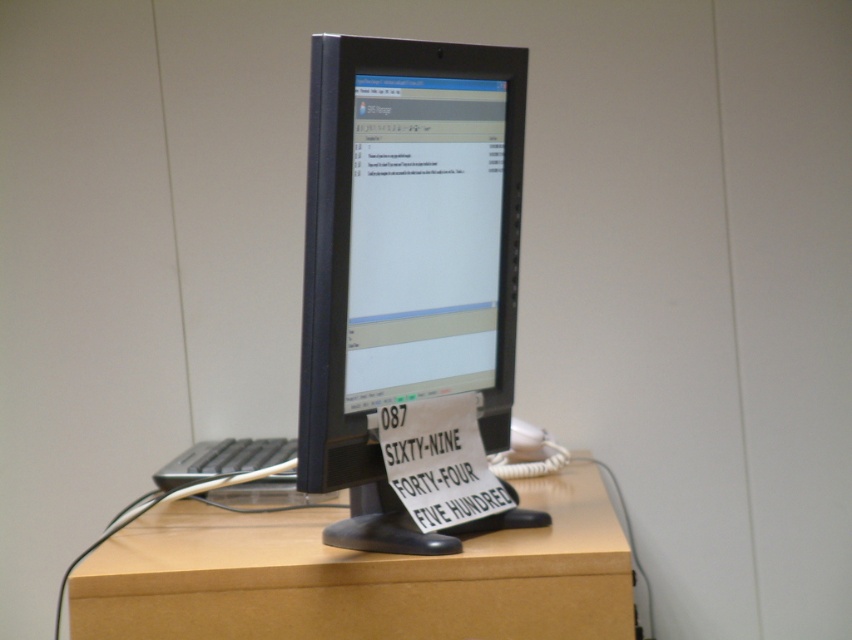
You are a technician who needs to place a new monitor stand between the matte black monitor at center and the light brown wood at center. The stand requires at least 40 centimeters of space to fit properly. Based on the scene description, will there be enough space for the stand?

The matte black monitor at center is only 37.55 centimeters away from the light brown wood at center, which is less than the required 40 centimeters. Therefore, there is not enough space to fit the monitor stand properly.

You are setting up a new monitor and need to ensure it doesn not block the view of a decorative plaque on the desk. The current setup has a matte black monitor at center and light brown wood at center. Which object is closer to you, the observer?

The matte black monitor at center is in front of light brown wood at center, so the matte black monitor at center is closer to you.

You are standing in front of a computer setup on a desk. There is a CRT monitor displaying an interface labeled SRS Manager. There is also a handwritten sign. Where is the point located at coordinates (491, 259) in relation to the CRT monitor and the handwritten sign?

The point at coordinates (491, 259) is 1.35 meters away from the viewer, but the exact location relative to the CRT monitor and the handwritten sign cannot be determined with the provided information.